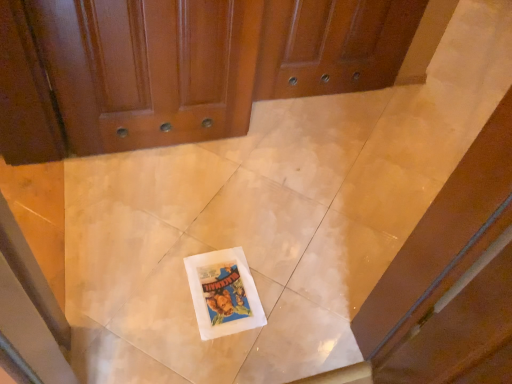
Question: From a real-world perspective, is white paper comic book at center below glossy wood door at upper center?

Choices:
 (A) no
 (B) yes

Answer: (B)

Question: Is white paper comic book at center facing away from glossy wood door at upper center?

Choices:
 (A) no
 (B) yes

Answer: (A)

Question: Considering the relative positions of white paper comic book at center and glossy wood door at upper center in the image provided, is white paper comic book at center to the left of glossy wood door at upper center from the viewer's perspective?

Choices:
 (A) no
 (B) yes

Answer: (A)

Question: From the image's perspective, is white paper comic book at center over glossy wood door at upper center?

Choices:
 (A) yes
 (B) no

Answer: (B)

Question: Is white paper comic book at center smaller than glossy wood door at upper center?

Choices:
 (A) no
 (B) yes

Answer: (B)

Question: From a real-world perspective, is white paper comic book at center on glossy wood door at upper center?

Choices:
 (A) yes
 (B) no

Answer: (B)

Question: Is glossy wood door at upper center turned away from white paper comic book at center?

Choices:
 (A) yes
 (B) no

Answer: (B)

Question: Is glossy wood door at upper center behind white paper comic book at center?

Choices:
 (A) no
 (B) yes

Answer: (A)

Question: Considering the relative sizes of glossy wood door at upper center and white paper comic book at center in the image provided, is glossy wood door at upper center shorter than white paper comic book at center?

Choices:
 (A) yes
 (B) no

Answer: (B)

Question: Is the depth of glossy wood door at upper center less than that of white paper comic book at center?

Choices:
 (A) no
 (B) yes

Answer: (B)

Question: From the image's perspective, would you say glossy wood door at upper center is positioned over white paper comic book at center?

Choices:
 (A) yes
 (B) no

Answer: (A)

Question: Does glossy wood door at upper center have a greater height compared to white paper comic book at center?

Choices:
 (A) yes
 (B) no

Answer: (A)

Question: From a real-world perspective, relative to white paper comic book at center, is glossy wood door at upper center vertically above or below?

Choices:
 (A) above
 (B) below

Answer: (A)